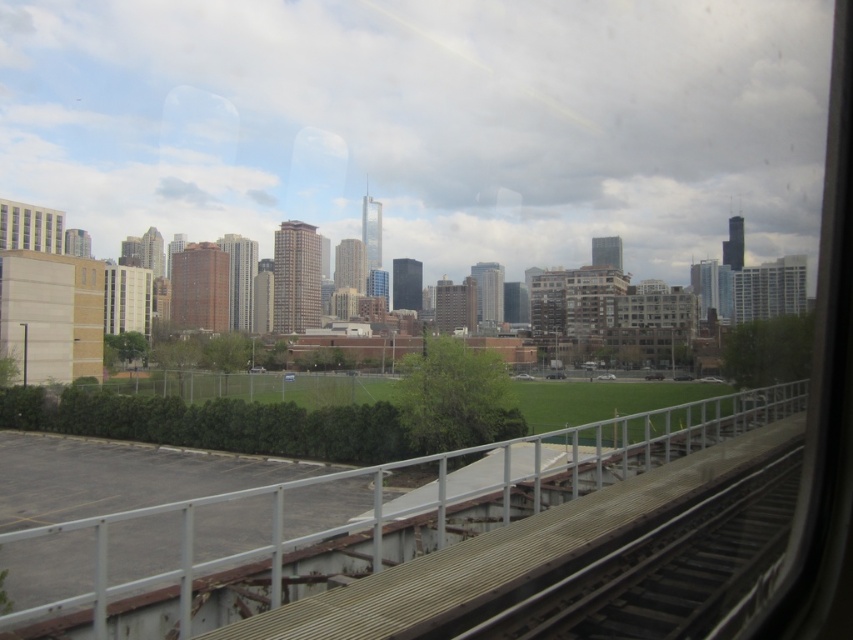
You are a photographer trying to capture the entire scene through the train window. Given that the smooth metal train track at lower right and the matte glass building at left are both in your viewfinder, which object will require you to adjust your framing to include more of it?

The matte glass building at left requires adjusting the framing to include more of it because it occupies more space than the smooth metal train track at lower right.